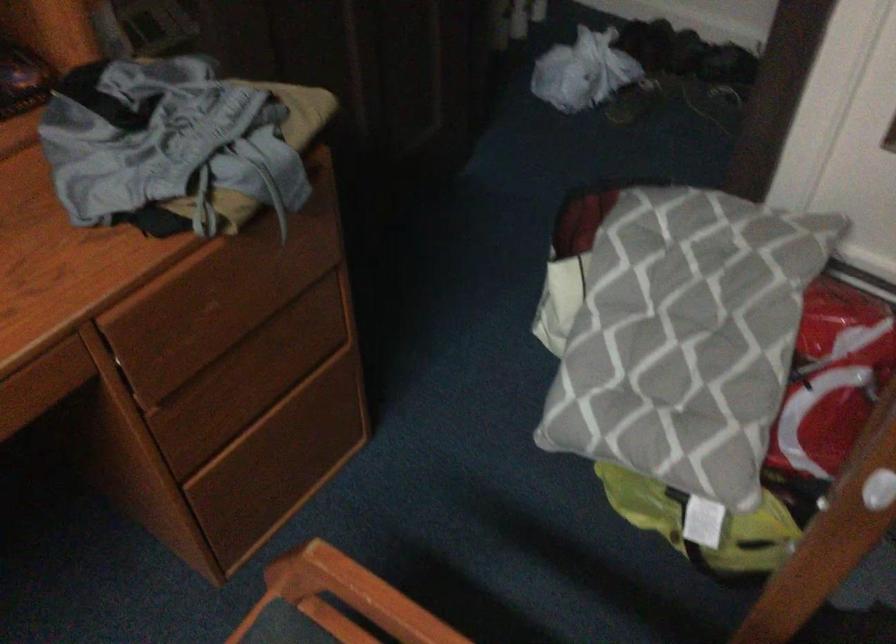
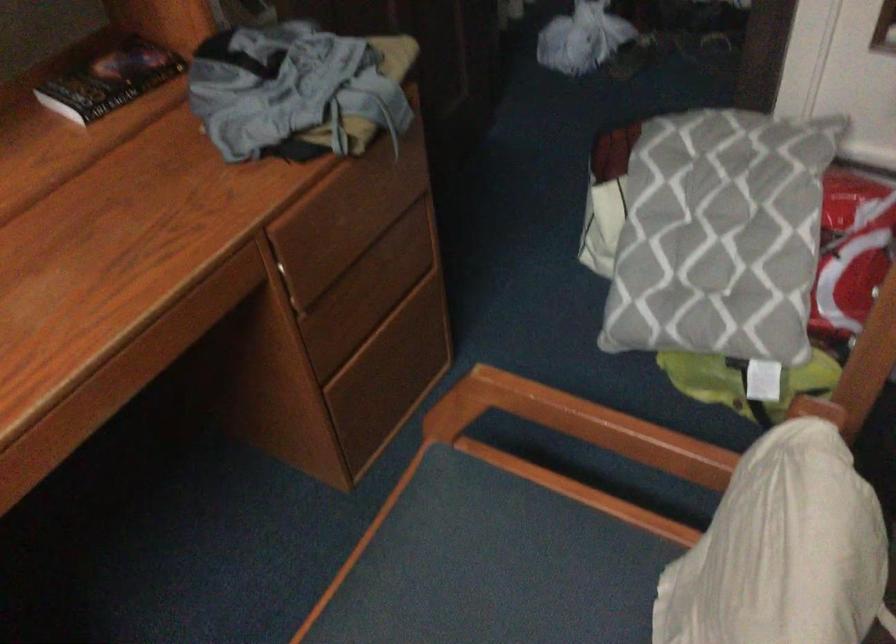
In the second image, find the point that corresponds to point (682, 339) in the first image.

(719, 236)